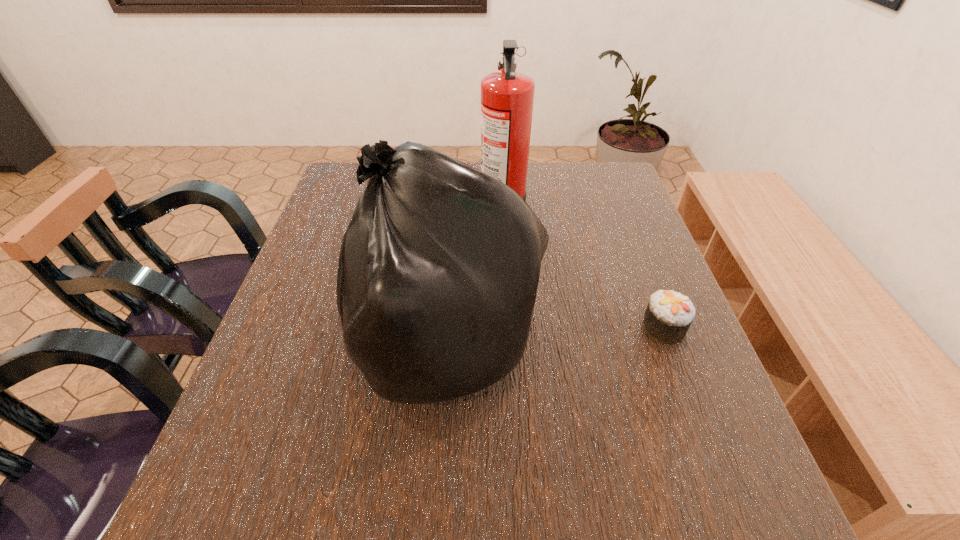
Find the location of `the farthest object`. the farthest object is located at coordinates (507, 97).

Locate an element on the screen. plastic bag is located at coordinates (439, 267).

Identify the location of the rightmost object. (669, 314).

In order to click on cupcake in this screenshot , I will do `click(669, 314)`.

Identify the location of free space located on the front-facing side of the farthest object. (340, 204).

Where is `vacant area located on the front-facing side of the farthest object`? vacant area located on the front-facing side of the farthest object is located at coordinates (372, 204).

This screenshot has height=540, width=960. Identify the location of blank space located on the front-facing side of the farthest object. (336, 204).

Where is `vacant space located 0.380m on the back of the plastic bag`? The height and width of the screenshot is (540, 960). vacant space located 0.380m on the back of the plastic bag is located at coordinates (454, 188).

This screenshot has height=540, width=960. In order to click on vacant point located on the left of the rightmost object in this screenshot , I will do `click(574, 328)`.

The height and width of the screenshot is (540, 960). I want to click on object that is at the far edge, so click(x=507, y=97).